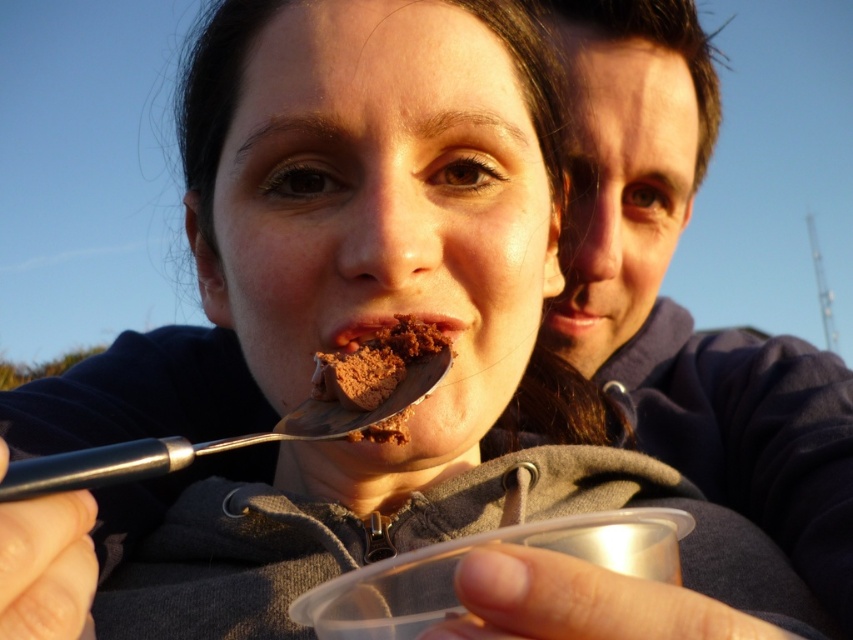
Question: Which of the following is the farthest from the observer?

Choices:
 (A) chocolate crumbly dessert at mouth
 (B) chocolate matte at center
 (C) matte blue hoodie at upper right

Answer: (C)

Question: Can you confirm if chocolate crumbly dessert at mouth is thinner than chocolate matte at center?

Choices:
 (A) yes
 (B) no

Answer: (B)

Question: Which point is closer to the camera?

Choices:
 (A) chocolate matte at center
 (B) matte blue hoodie at upper right
 (C) chocolate crumbly dessert at mouth

Answer: (C)

Question: Which of the following is the farthest from the observer?

Choices:
 (A) chocolate crumbly dessert at mouth
 (B) matte blue hoodie at upper right
 (C) chocolate matte at center

Answer: (B)

Question: Does matte blue hoodie at upper right have a larger size compared to chocolate matte at center?

Choices:
 (A) yes
 (B) no

Answer: (A)

Question: Can you confirm if chocolate crumbly dessert at mouth is bigger than chocolate matte at center?

Choices:
 (A) yes
 (B) no

Answer: (A)